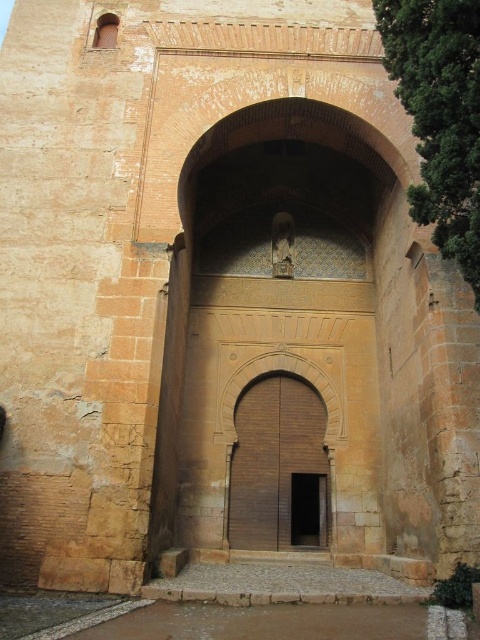
Question: Is brown wooden door at center positioned at the back of wooden door at center?

Choices:
 (A) no
 (B) yes

Answer: (A)

Question: Is brown wooden door at center thinner than wooden door at center?

Choices:
 (A) no
 (B) yes

Answer: (A)

Question: Is brown wooden door at center wider than wooden door at center?

Choices:
 (A) yes
 (B) no

Answer: (A)

Question: Among these points, which one is farthest from the camera?

Choices:
 (A) (304, 435)
 (B) (325, 529)

Answer: (A)

Question: Which of the following is the closest to the observer?

Choices:
 (A) tap(288, 461)
 (B) tap(322, 484)

Answer: (A)

Question: Among these points, which one is nearest to the camera?

Choices:
 (A) (265, 518)
 (B) (309, 483)

Answer: (A)